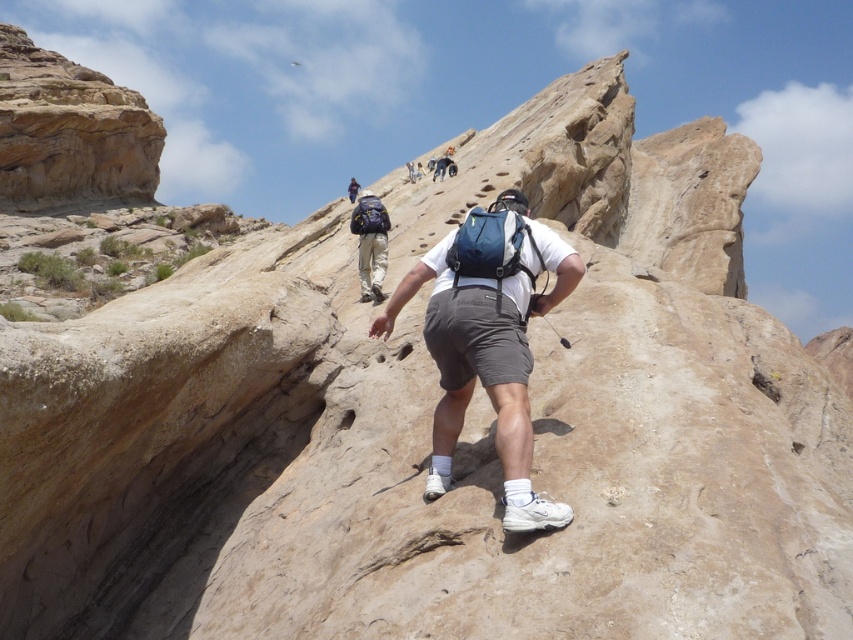
Based on the photo, is matte blue backpack at center to the right of matte black backpack at upper center from the viewer's perspective?

Correct, you'll find matte blue backpack at center to the right of matte black backpack at upper center.

Which is in front, point (529, 445) or point (347, 193)?

Point (529, 445) is more forward.

At what (x,y) coordinates should I click in order to perform the action: click on matte blue backpack at center. Please return your answer as a coordinate pair (x, y). The width and height of the screenshot is (853, 640). Looking at the image, I should click on (489, 339).